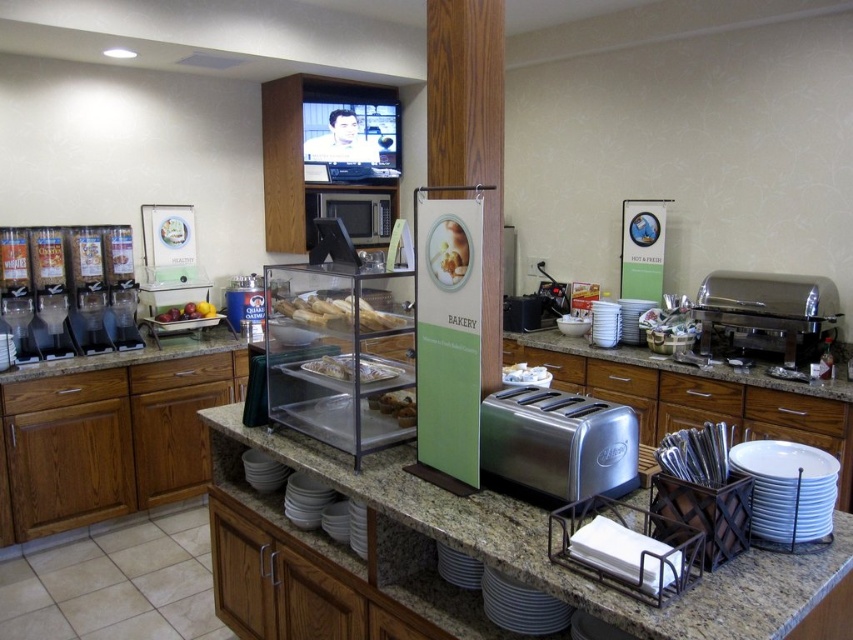
You are a hotel guest who wants to take a plate from the white ceramic plates at lower right and put it into the brushed metal drawer at center. Can you do this without moving any other items in between?

The white ceramic plates at lower right is closer to the viewer than the brushed metal drawer at center, so you can easily reach the white ceramic plates at lower right first and then place it into the brushed metal drawer at center without moving other items.

You are a hotel guest who wants to grab a slightly golden bread at center and a shiny metallic fruit basket at center. If you can only reach items within 1.5 meters of each other, can you pick both without moving your position?

The distance between the slightly golden bread at center and the shiny metallic fruit basket at center is 2.04 meters, which is greater than 1.5 meters. Therefore, you cannot reach both items without moving your position.

You are a hotel guest who wants to grab a plate before getting food. The white ceramic plates at lower right is located at point (788, 488). Where should you go to find the white ceramic plates at lower right?

The white ceramic plates at lower right is located at point (788, 488), so you should go to that coordinate to find them.